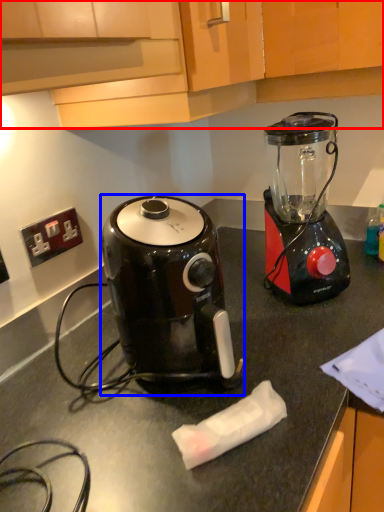
Question: Which object is closer to the camera taking this photo, cabinetry (highlighted by a red box) or coffee maker (highlighted by a blue box)?

Choices:
 (A) cabinetry
 (B) coffee maker

Answer: (A)